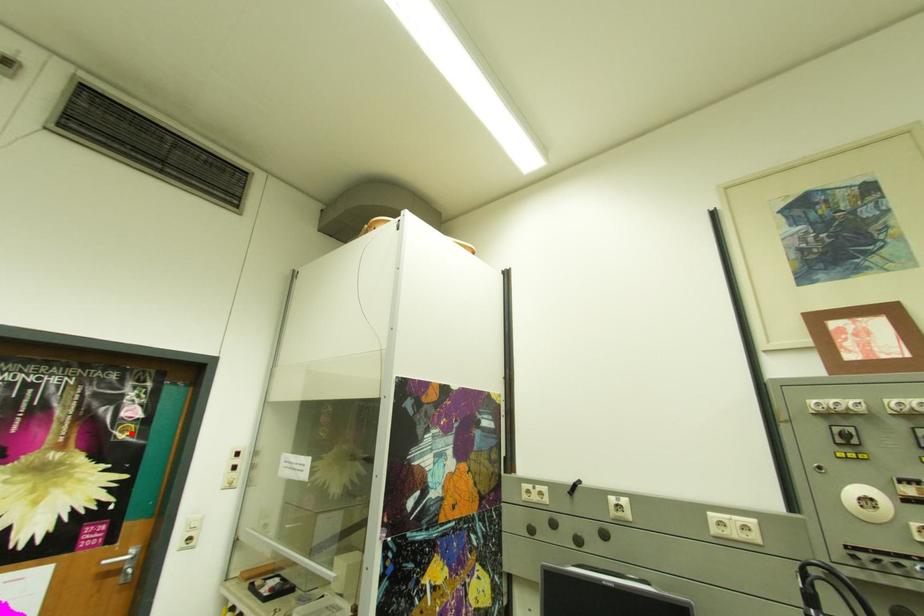
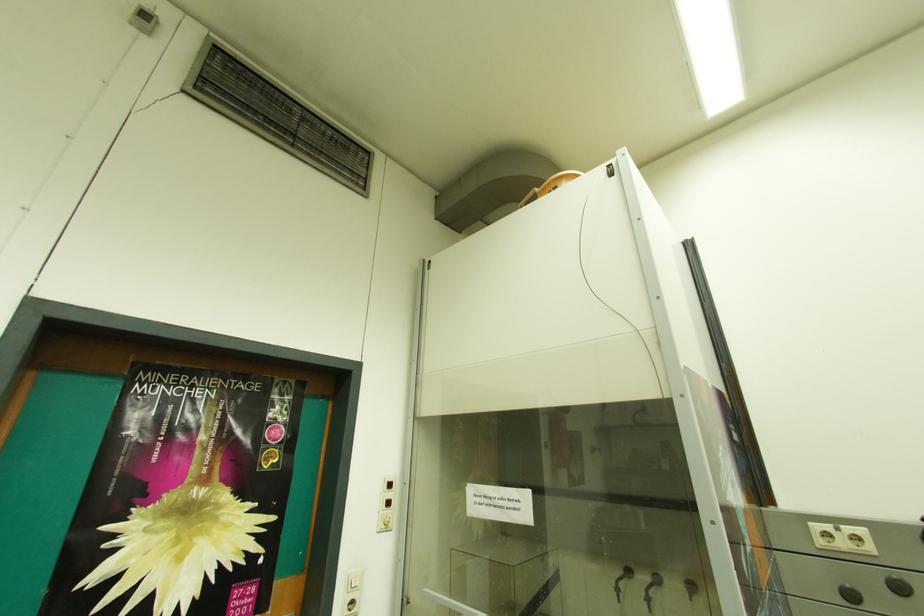
Locate, in the second image, the point that corresponds to the highlighted location in the first image.

(275, 460)